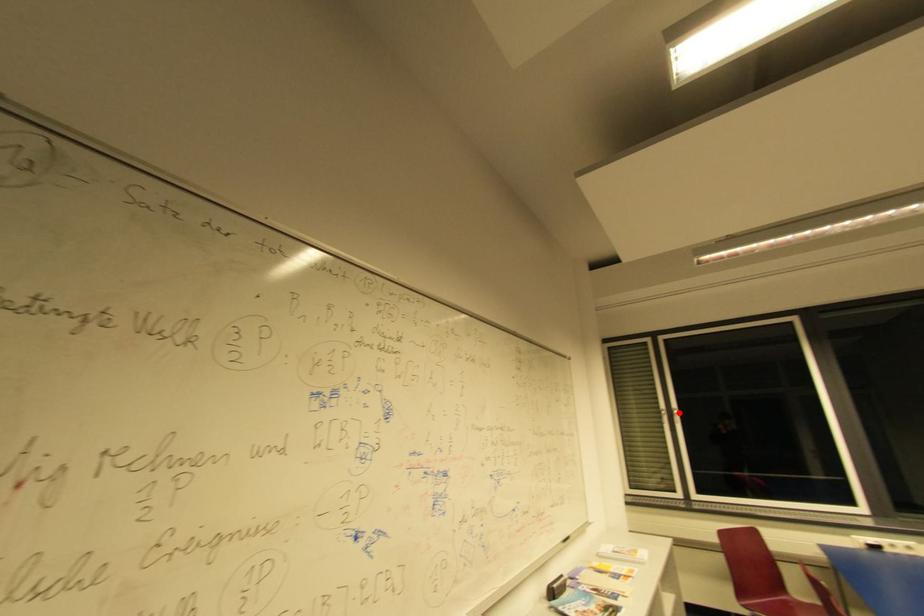
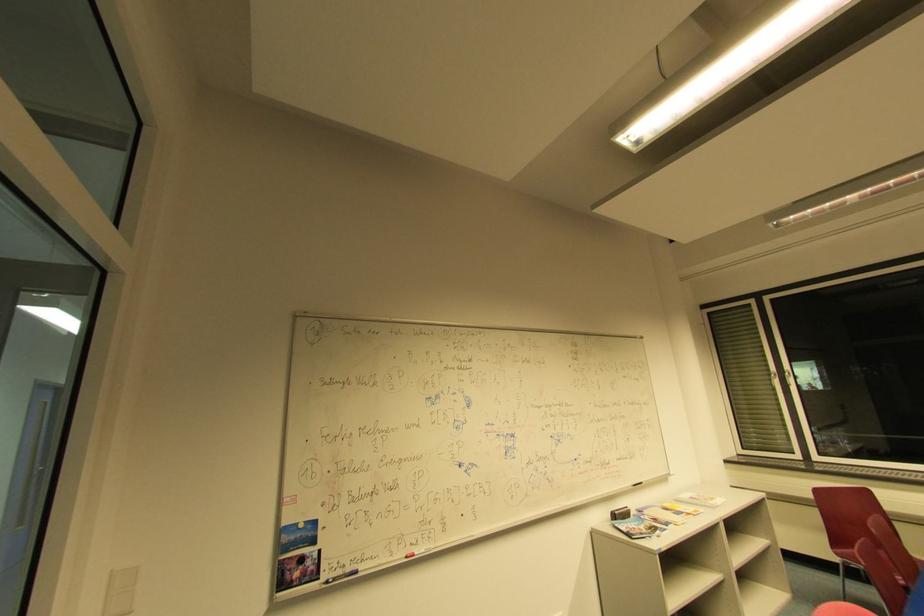
In the second image, find the point that corresponds to the highlighted location in the first image.

(791, 375)